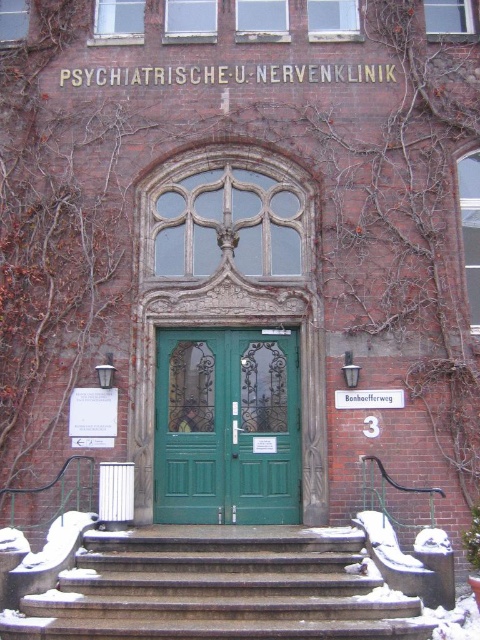
Question: Which point is farther from the camera taking this photo?

Choices:
 (A) (291, 502)
 (B) (191, 618)

Answer: (A)

Question: Where is dark gray stone stairs at center located in relation to green painted wood door at center in the image?

Choices:
 (A) left
 (B) right

Answer: (B)

Question: Is dark gray stone stairs at center positioned before green matte door at center?

Choices:
 (A) no
 (B) yes

Answer: (B)

Question: Does dark gray stone stairs at center appear under green matte door at center?

Choices:
 (A) yes
 (B) no

Answer: (A)

Question: Which object is the closest to the green matte door at center?

Choices:
 (A) dark gray stone stairs at center
 (B) green painted wood door at center

Answer: (B)

Question: Which object appears closest to the camera in this image?

Choices:
 (A) green painted wood door at center
 (B) dark gray stone stairs at center
 (C) green matte door at center

Answer: (B)